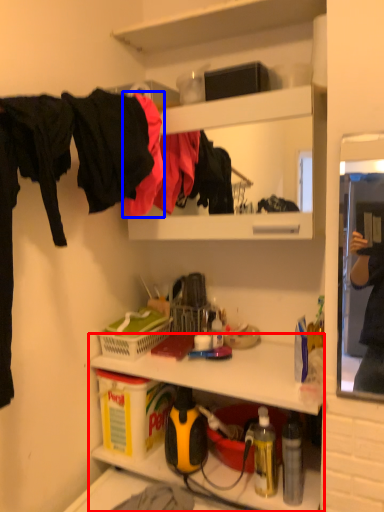
Question: Which of the following is the closest to the observer, shelf (highlighted by a red box) or clothing (highlighted by a blue box)?

Choices:
 (A) shelf
 (B) clothing

Answer: (A)